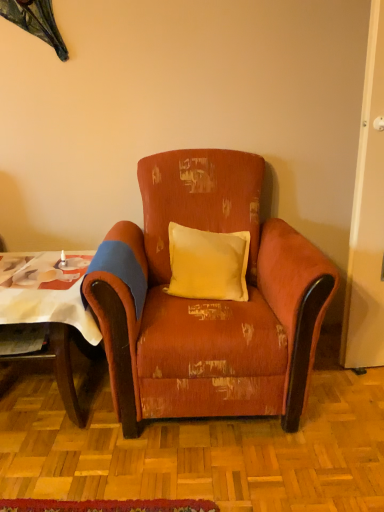
Question: Is distressed orange fabric armchair at center wider than wooden table at left?

Choices:
 (A) no
 (B) yes

Answer: (B)

Question: Is distressed orange fabric armchair at center taller than wooden table at left?

Choices:
 (A) yes
 (B) no

Answer: (A)

Question: Is the surface of distressed orange fabric armchair at center in direct contact with wooden table at left?

Choices:
 (A) no
 (B) yes

Answer: (A)

Question: From the image's perspective, is distressed orange fabric armchair at center on wooden table at left?

Choices:
 (A) no
 (B) yes

Answer: (B)

Question: Is distressed orange fabric armchair at center thinner than wooden table at left?

Choices:
 (A) no
 (B) yes

Answer: (A)

Question: Can you confirm if distressed orange fabric armchair at center is positioned to the right of wooden table at left?

Choices:
 (A) no
 (B) yes

Answer: (B)

Question: Could you tell me if distressed orange fabric armchair at center is facing yellow fabric pillow at center?

Choices:
 (A) no
 (B) yes

Answer: (B)

Question: Does distressed orange fabric armchair at center have a lesser width compared to yellow fabric pillow at center?

Choices:
 (A) no
 (B) yes

Answer: (A)

Question: Is distressed orange fabric armchair at center positioned with its back to yellow fabric pillow at center?

Choices:
 (A) no
 (B) yes

Answer: (B)

Question: Is distressed orange fabric armchair at center closer to the viewer compared to yellow fabric pillow at center?

Choices:
 (A) no
 (B) yes

Answer: (B)

Question: Considering the relative sizes of distressed orange fabric armchair at center and yellow fabric pillow at center in the image provided, is distressed orange fabric armchair at center taller than yellow fabric pillow at center?

Choices:
 (A) no
 (B) yes

Answer: (B)

Question: From the image's perspective, is distressed orange fabric armchair at center under yellow fabric pillow at center?

Choices:
 (A) no
 (B) yes

Answer: (B)

Question: From a real-world perspective, is yellow fabric pillow at center positioned over wooden table at left based on gravity?

Choices:
 (A) no
 (B) yes

Answer: (B)